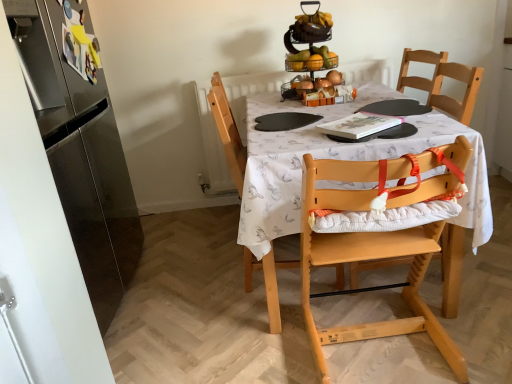
The width and height of the screenshot is (512, 384). In order to click on blank space to the left of light wood highchair at center, the first chair in the back-to-front sequence in this screenshot , I will do `click(201, 289)`.